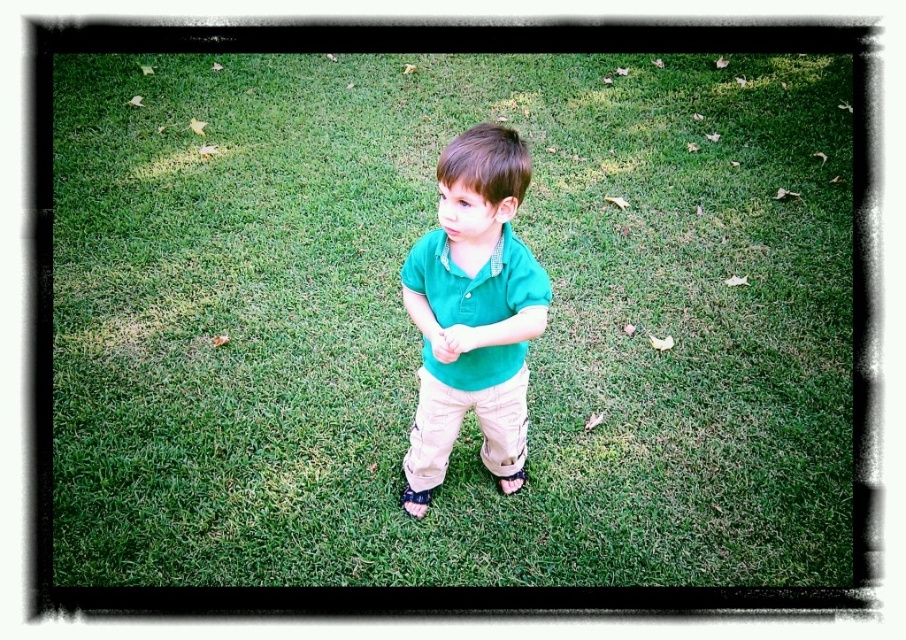
Question: Can you confirm if green cotton polo shirt at center is positioned below khaki cotton pants at center?

Choices:
 (A) yes
 (B) no

Answer: (B)

Question: Which object is positioned closest to the green cotton shirt at center?

Choices:
 (A) green cotton polo shirt at center
 (B) khaki cotton pants at center
 (C) black leather sandal at lower center

Answer: (A)

Question: Does green grass at center have a greater width compared to black leather sandal at lower center?

Choices:
 (A) yes
 (B) no

Answer: (A)

Question: Can you confirm if green cotton polo shirt at center is positioned below matte green shirt at center?

Choices:
 (A) yes
 (B) no

Answer: (B)

Question: Which point is closer to the camera?

Choices:
 (A) black leather sandal at lower center
 (B) green cotton polo shirt at center

Answer: (B)

Question: Which point is closer to the camera taking this photo?

Choices:
 (A) (467, 524)
 (B) (439, 436)
 (C) (503, 476)
 (D) (512, 412)

Answer: (D)